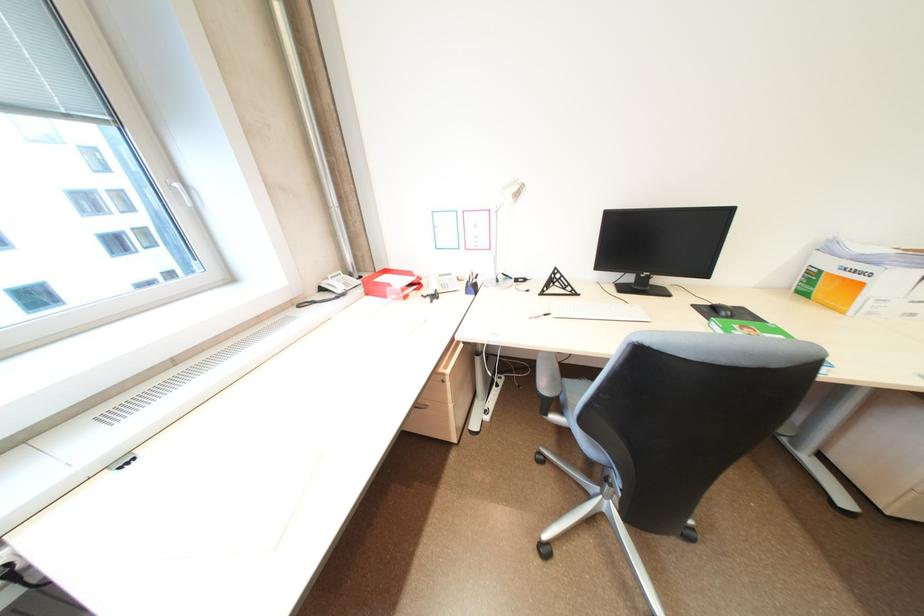
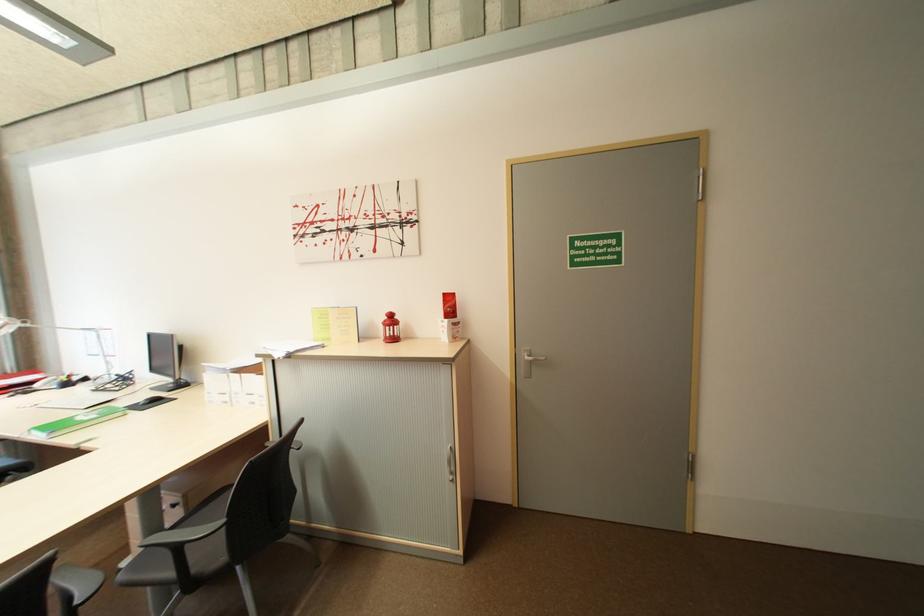
Question: The images are taken continuously from a first-person perspective. In which direction are you moving?

Choices:
 (A) Left
 (B) Right
 (C) Forward
 (D) Backward

Answer: (B)